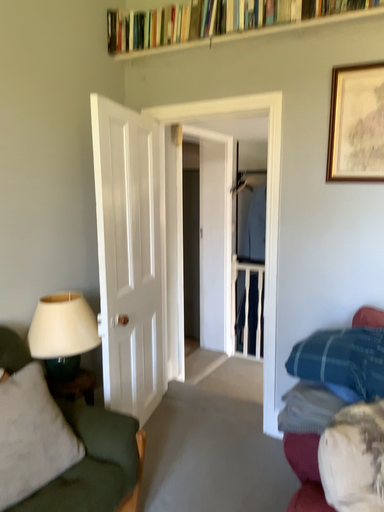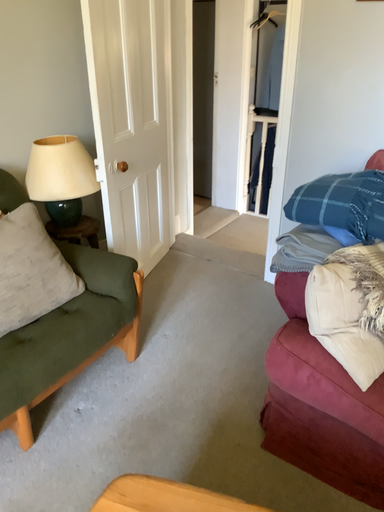
Question: Which way did the camera rotate in the video?

Choices:
 (A) rotated downward
 (B) rotated upward

Answer: (A)